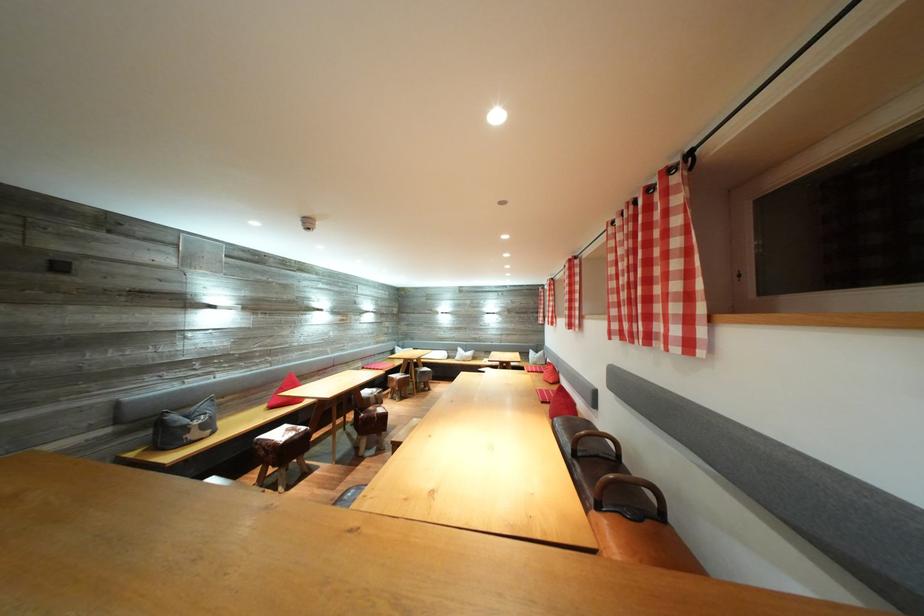
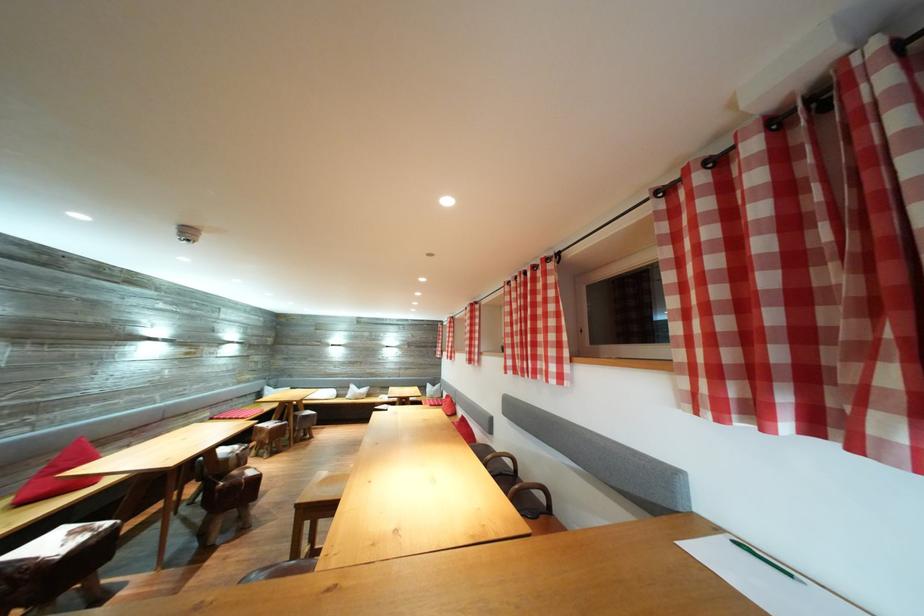
Where in the second image is the point corresponding to point (406, 378) from the first image?

(275, 424)